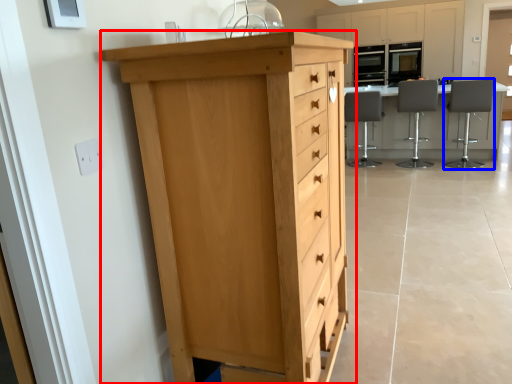
Question: Which object appears farthest to the camera in this image, chest of drawers (highlighted by a red box) or chair (highlighted by a blue box)?

Choices:
 (A) chest of drawers
 (B) chair

Answer: (B)